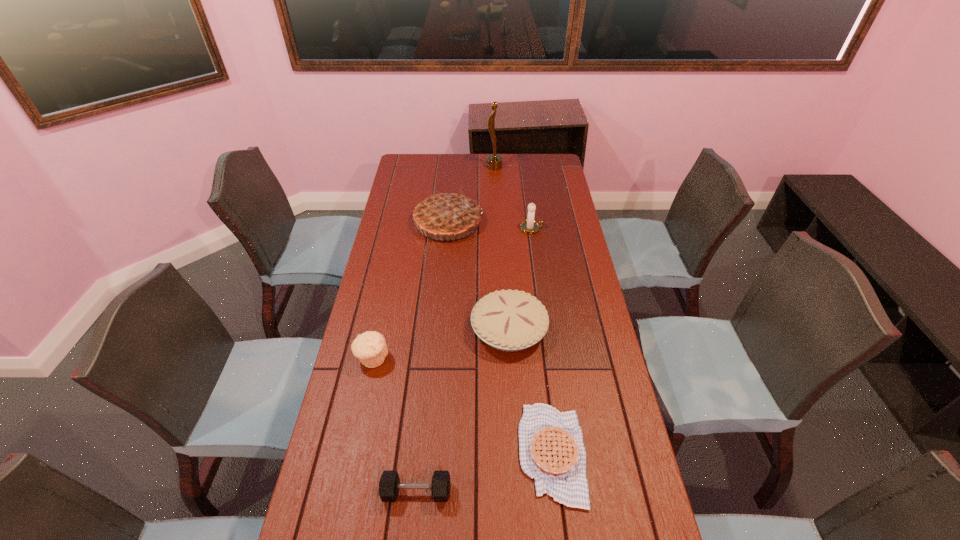
At what (x,y) coordinates should I click in order to perform the action: click on empty location between the second shortest object and the second nearest pie. Please return your answer as a coordinate pair (x, y). The image size is (960, 540). Looking at the image, I should click on (463, 410).

Where is `free spot between the second shortest pie and the award`? The height and width of the screenshot is (540, 960). free spot between the second shortest pie and the award is located at coordinates (502, 248).

The height and width of the screenshot is (540, 960). What are the coordinates of `free point between the muffin and the second shortest pie` in the screenshot? It's located at (441, 343).

Identify the location of vacant region between the farthest object and the second shortest object. The height and width of the screenshot is (540, 960). (456, 329).

Find the location of a particular element. The image size is (960, 540). vacant point located between the muffin and the shortest pie is located at coordinates (462, 406).

Where is `vacant region between the leftmost object and the candle holder`? vacant region between the leftmost object and the candle holder is located at coordinates (452, 293).

Locate which object is the sixth closest to the second tallest object. Please provide its 2D coordinates. Your answer should be formatted as a tuple, i.e. [(x, y)], where the tuple contains the x and y coordinates of a point satisfying the conditions above.

[(389, 485)]

Find the location of a particular element. the second closest object to the leftmost object is located at coordinates (389, 485).

Locate which pie is the second closest to the second nearest pie. Please provide its 2D coordinates. Your answer should be formatted as a tuple, i.e. [(x, y)], where the tuple contains the x and y coordinates of a point satisfying the conditions above.

[(445, 214)]

Where is `the second closest pie to the dumbbell`? This screenshot has width=960, height=540. the second closest pie to the dumbbell is located at coordinates pos(510,320).